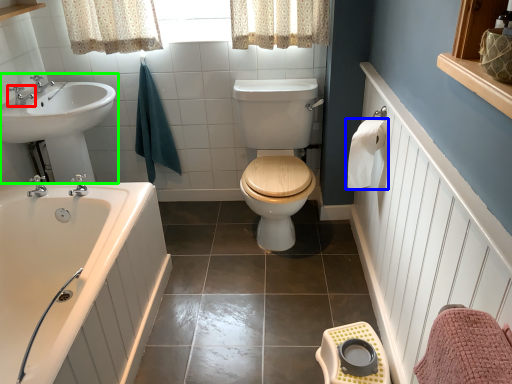
Question: Which object is the closest to the tap (highlighted by a red box)? Choose among these: toilet paper (highlighted by a blue box) or sink (highlighted by a green box).

Choices:
 (A) toilet paper
 (B) sink

Answer: (B)